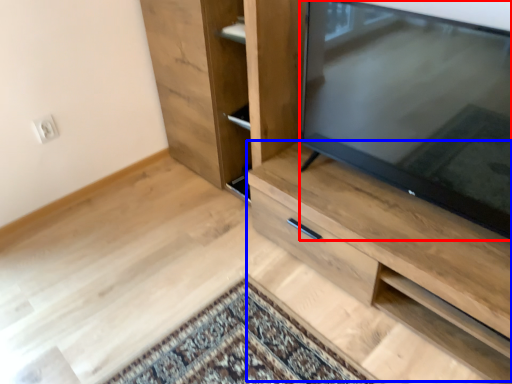
Question: Which point is further to the camera, television (highlighted by a red box) or cabinetry (highlighted by a blue box)?

Choices:
 (A) television
 (B) cabinetry

Answer: (B)